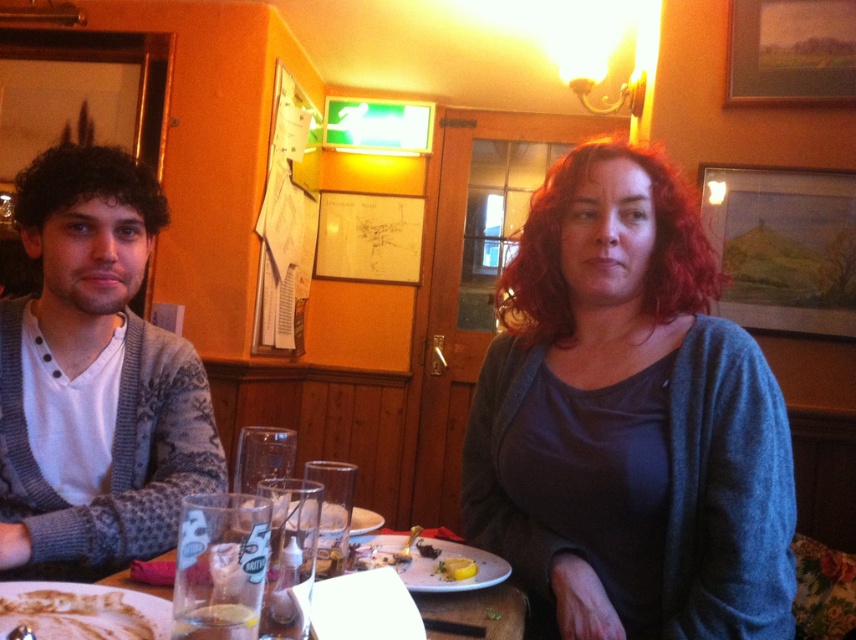
You are a food delivery person who needs to place a small, unbreakable item on the table between the white creamy cake at lower left and the yellow matte lemon at lower center. Which object should you place it closer to to ensure it doesn

The white creamy cake at lower left is taller than the yellow matte lemon at lower center. To ensure the item is placed closer to the shorter object, you should place it near the yellow matte lemon at lower center.

You are a customer at the pub and want to place your phone on the table. The dark gray sweater at center and the knitted gray sweater at left are in the way. Which sweater should you move to the left to make space?

You should move the knitted gray sweater at left to the left because it is already positioned to the left of the dark gray sweater at center, so moving it further left would create space on the right side of the table.